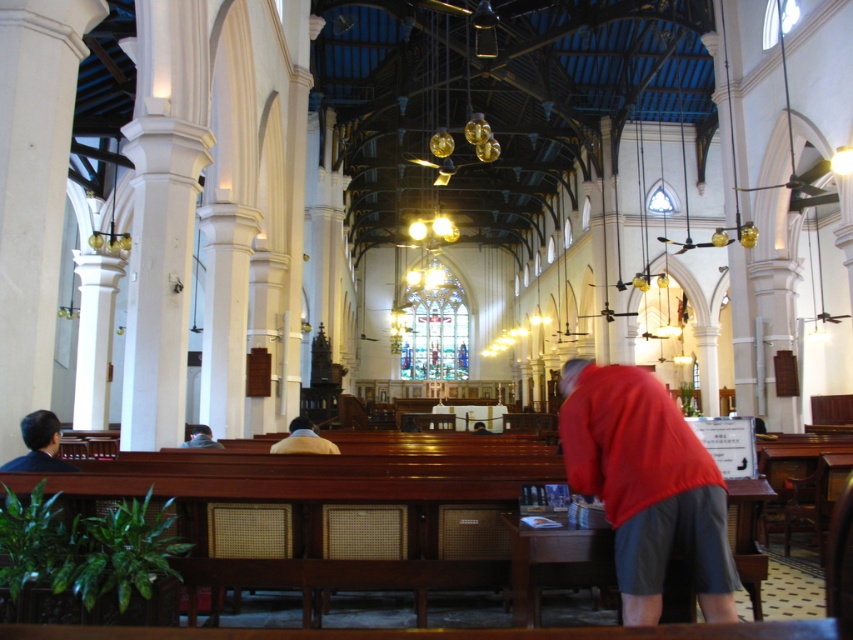
You are standing at the entrance of the grand church and notice two items at the center of the scene. The red matte shirt at center and the yellow fabric jacket at center. Which one is positioned higher?

The red matte shirt at center is located above the yellow fabric jacket at center, so it is positioned higher.